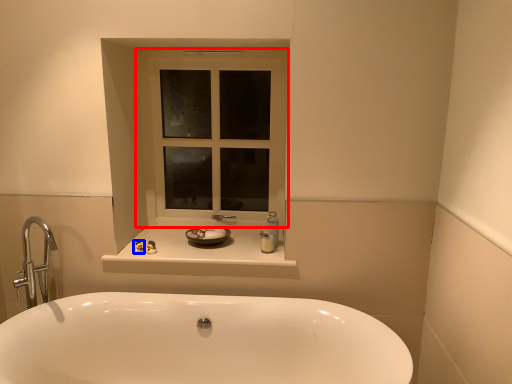
Question: Which of the following is the farthest to the observer, window (highlighted by a red box) or toiletry (highlighted by a blue box)?

Choices:
 (A) window
 (B) toiletry

Answer: (A)